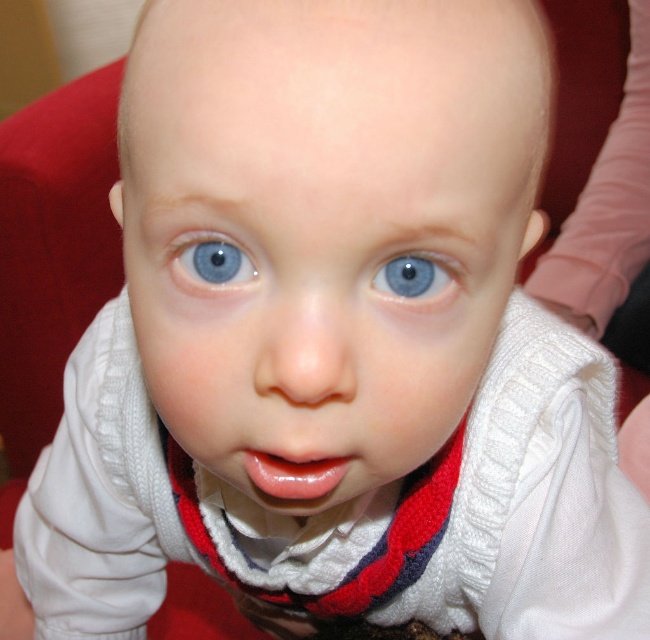
Question: Which point is closer to the camera?

Choices:
 (A) glossy pink lips at center
 (B) blue smooth eye at center

Answer: (B)

Question: Is glossy pink lips at center closer to camera compared to blue smooth eye at center?

Choices:
 (A) no
 (B) yes

Answer: (A)

Question: Which of the following is the farthest from the observer?

Choices:
 (A) (429, 275)
 (B) (296, 481)
 (C) (211, 280)

Answer: (B)

Question: Which of the following is the closest to the observer?

Choices:
 (A) blue smooth eye at center
 (B) blue glossy eye at center
 (C) glossy pink lips at center

Answer: (A)

Question: Can you confirm if glossy pink lips at center is wider than blue smooth eye at center?

Choices:
 (A) yes
 (B) no

Answer: (A)

Question: Can you confirm if glossy pink lips at center is positioned to the right of blue glossy eye at center?

Choices:
 (A) no
 (B) yes

Answer: (A)